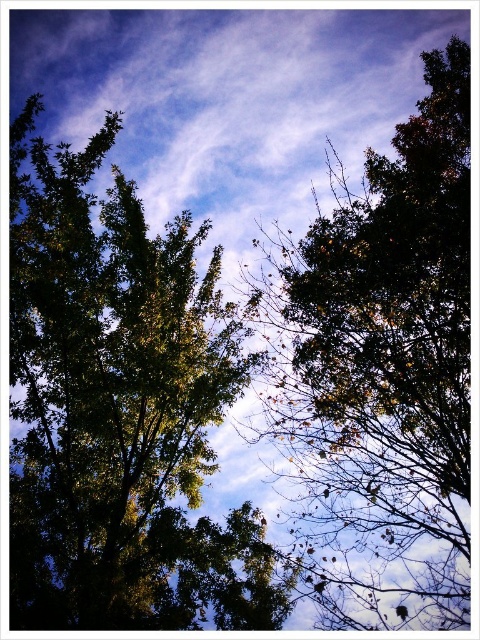
Question: In this image, where is green leafy tree at center located relative to dark green leafy tree at upper center?

Choices:
 (A) above
 (B) below

Answer: (B)

Question: Which object is closer to the camera taking this photo?

Choices:
 (A) dark green leafy tree at upper center
 (B) green leafy tree at center

Answer: (A)

Question: Which object is closer to the camera taking this photo?

Choices:
 (A) green leafy tree at center
 (B) dark green leafy tree at upper center

Answer: (B)

Question: Can you confirm if green leafy tree at center is thinner than dark green leafy tree at upper center?

Choices:
 (A) yes
 (B) no

Answer: (B)

Question: Can you confirm if green leafy tree at center is wider than dark green leafy tree at upper center?

Choices:
 (A) yes
 (B) no

Answer: (A)